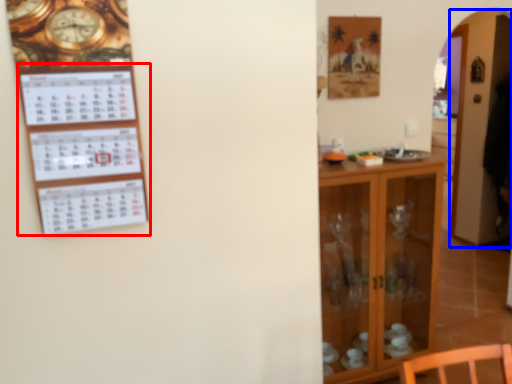
Question: Which point is further to the camera, bulletin board (highlighted by a red box) or glass door (highlighted by a blue box)?

Choices:
 (A) bulletin board
 (B) glass door

Answer: (B)